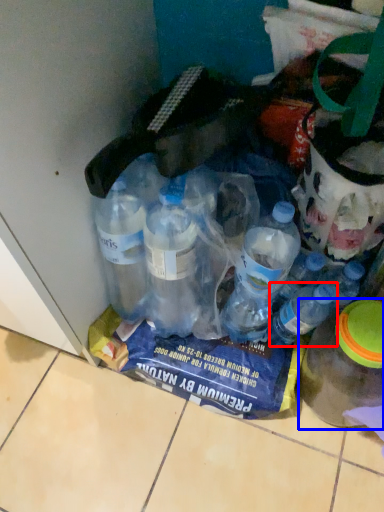
Question: Which object appears closest to the camera in this image, bottle (highlighted by a red box) or bottle (highlighted by a blue box)?

Choices:
 (A) bottle
 (B) bottle

Answer: (B)